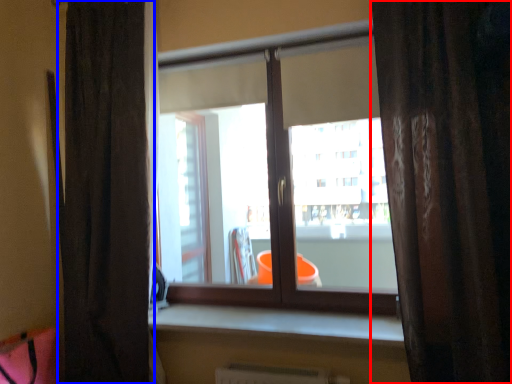
Question: Which object appears closest to the camera in this image, curtain (highlighted by a red box) or curtain (highlighted by a blue box)?

Choices:
 (A) curtain
 (B) curtain

Answer: (A)